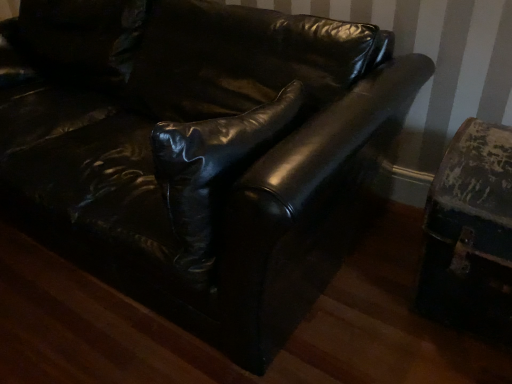
What is the approximate width of rusty metal trunk at right?

17.66 inches.

The image size is (512, 384). What do you see at coordinates (470, 233) in the screenshot?
I see `rusty metal trunk at right` at bounding box center [470, 233].

The width and height of the screenshot is (512, 384). What are the coordinates of `rusty metal trunk at right` in the screenshot? It's located at (470, 233).

Identify the location of rusty metal trunk at right. This screenshot has height=384, width=512. (470, 233).